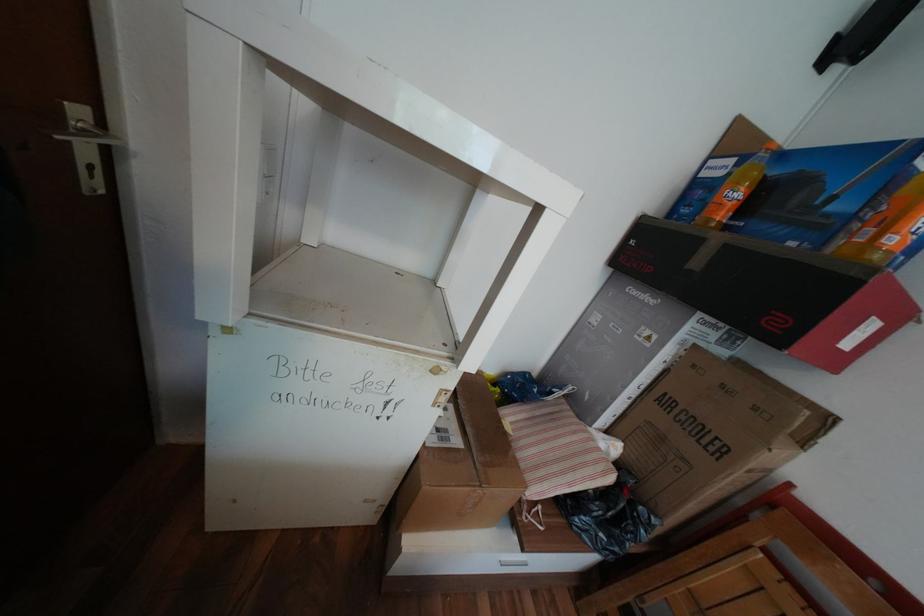
The image size is (924, 616). What do you see at coordinates (88, 134) in the screenshot?
I see `the silver door handle` at bounding box center [88, 134].